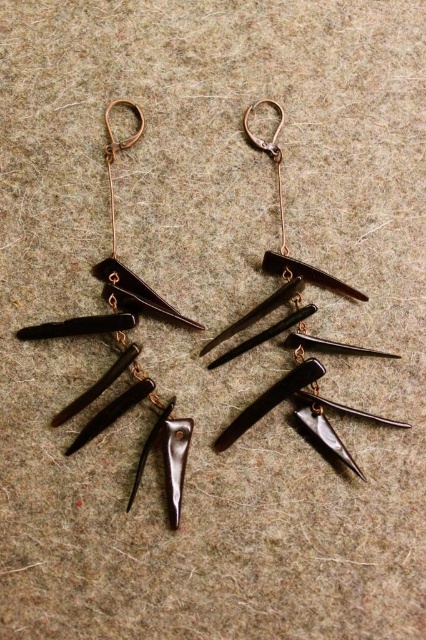
You are an earring designer examining the layout of the matte black spike at upper left and the matte black spike at upper center. Which spike would cast a longer shadow if the light source is coming from above?

The matte black spike at upper left has a greater height compared to matte black spike at upper center, so it would cast a longer shadow.

What is located at the coordinates point (115, 243) in the image?

The point (115, 243) marks a matte black spike at upper left.